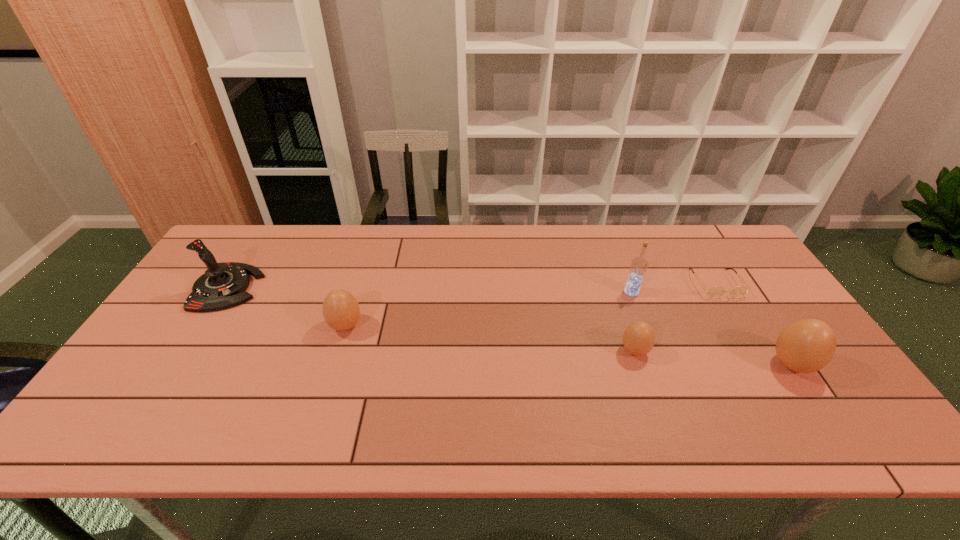
This screenshot has height=540, width=960. I want to click on vacant space that satisfies the following two spatial constraints: 1. on the handle side of the rightmost boiled egg; 2. on the right side of the leftmost object, so click(x=179, y=364).